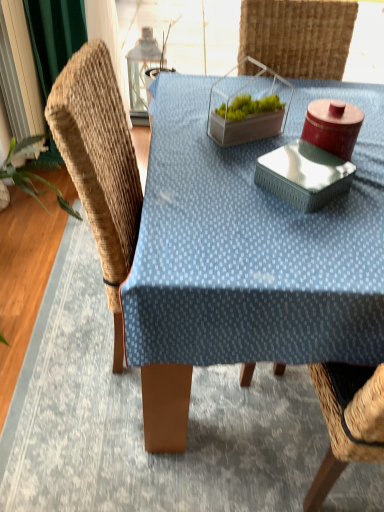
Question: Relative to blue fabric table at center, is woven wood swivel chair at left in front or behind?

Choices:
 (A) front
 (B) behind

Answer: (B)

Question: Is woven wood swivel chair at left taller or shorter than blue fabric table at center?

Choices:
 (A) tall
 (B) short

Answer: (A)

Question: From the image's perspective, relative to blue fabric table at center, is woven wood swivel chair at left above or below?

Choices:
 (A) above
 (B) below

Answer: (A)

Question: In terms of width, does blue fabric table at center look wider or thinner when compared to woven wood swivel chair at left?

Choices:
 (A) wide
 (B) thin

Answer: (A)

Question: From a real-world perspective, is blue fabric table at center above or below woven wood swivel chair at left?

Choices:
 (A) above
 (B) below

Answer: (B)

Question: From the image's perspective, is blue fabric table at center positioned above or below woven wood swivel chair at left?

Choices:
 (A) below
 (B) above

Answer: (A)

Question: Considering the positions of point (198, 310) and point (115, 333), is point (198, 310) closer or farther from the camera than point (115, 333)?

Choices:
 (A) farther
 (B) closer

Answer: (B)